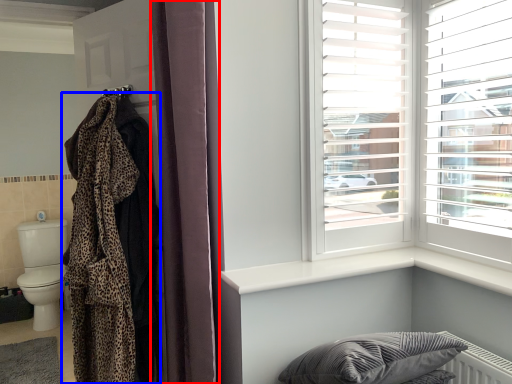
Question: Among these objects, which one is nearest to the camera, curtain (highlighted by a red box) or blanket (highlighted by a blue box)?

Choices:
 (A) curtain
 (B) blanket

Answer: (A)